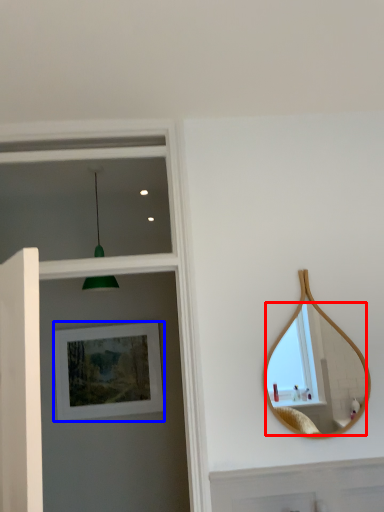
Question: Which object is further to the camera taking this photo, mirror (highlighted by a red box) or picture frame (highlighted by a blue box)?

Choices:
 (A) mirror
 (B) picture frame

Answer: (B)